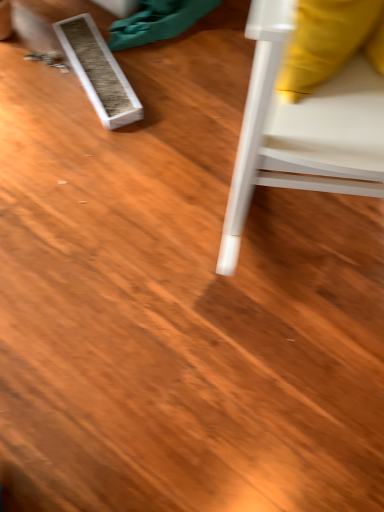
This screenshot has height=512, width=384. What are the coordinates of `white textured box at upper left` in the screenshot? It's located at (98, 72).

Image resolution: width=384 pixels, height=512 pixels. What do you see at coordinates (98, 72) in the screenshot?
I see `white textured box at upper left` at bounding box center [98, 72].

The image size is (384, 512). In order to click on white plastic chair at right in this screenshot , I will do `click(302, 129)`.

What do you see at coordinates (302, 129) in the screenshot? I see `white plastic chair at right` at bounding box center [302, 129].

Image resolution: width=384 pixels, height=512 pixels. Identify the location of white textured box at upper left. (98, 72).

In the image, is white textured box at upper left on the left side or the right side of white plastic chair at right?

white textured box at upper left is to the left of white plastic chair at right.

Is white textured box at upper left behind white plastic chair at right?

Yes.

Is point (104, 61) closer to camera compared to point (219, 261)?

That is False.

From the image's perspective, is white textured box at upper left above or below white plastic chair at right?

white textured box at upper left is situated higher than white plastic chair at right in the image.

From a real-world perspective, which object rests below the other?

white textured box at upper left is physically lower.

Which of these two, white textured box at upper left or white plastic chair at right, is thinner?

With smaller width is white textured box at upper left.

From their relative heights in the image, would you say white textured box at upper left is taller or shorter than white plastic chair at right?

white textured box at upper left is shorter than white plastic chair at right.

Is white textured box at upper left bigger than white plastic chair at right?

Actually, white textured box at upper left might be smaller than white plastic chair at right.

Can white plastic chair at right be found inside white textured box at upper left?

That's incorrect, white plastic chair at right is not inside white textured box at upper left.

Are white textured box at upper left and white plastic chair at right making contact?

There is a gap between white textured box at upper left and white plastic chair at right.

Is white textured box at upper left oriented away from white plastic chair at right?

No.

What's the angular difference between white textured box at upper left and white plastic chair at right's facing directions?

The angle between the facing direction of white textured box at upper left and the facing direction of white plastic chair at right is 58.8 degrees.

You are a GUI agent. You are given a task and a screenshot of the screen. Output one action in this format:
    pyautogui.click(x=<x>, y=<y>)
    Task: Click on the furniture that is below the white textured box at upper left (from the image's perspective)
    The height and width of the screenshot is (512, 384).
    Given the screenshot: What is the action you would take?
    pyautogui.click(x=302, y=129)

Which object is positioned more to the left, white plastic chair at right or white textured box at upper left?

Positioned to the left is white textured box at upper left.

Is the depth of white plastic chair at right less than that of white textured box at upper left?

Yes, white plastic chair at right is closer to the camera.

Is point (274, 177) farther from viewer compared to point (91, 93)?

No, (274, 177) is in front of (91, 93).

From the image's perspective, is white plastic chair at right located above or below white textured box at upper left?

Based on their image positions, white plastic chair at right is located beneath white textured box at upper left.

From a real-world perspective, is white plastic chair at right physically below white textured box at upper left?

Actually, white plastic chair at right is physically above white textured box at upper left in the real world.

Which of these two, white plastic chair at right or white textured box at upper left, is thinner?

white textured box at upper left is thinner.

Is white plastic chair at right shorter than white textured box at upper left?

No.

Looking at the image, does white plastic chair at right seem bigger or smaller compared to white textured box at upper left?

In the image, white plastic chair at right appears to be larger than white textured box at upper left.

Is white plastic chair at right positioned beyond the bounds of white textured box at upper left?

That's correct, white plastic chair at right is outside of white textured box at upper left.

Is white plastic chair at right positioned far away from white textured box at upper left?

Actually, white plastic chair at right and white textured box at upper left are a little close together.

In the scene shown: Is white plastic chair at right turned away from white textured box at upper left?

No, white plastic chair at right's orientation is not away from white textured box at upper left.

How far apart are white plastic chair at right and white textured box at upper left?

white plastic chair at right and white textured box at upper left are 73.60 centimeters apart from each other.

This screenshot has height=512, width=384. Find the location of `plank below the white plastic chair at right (from a real-world perspective)`. plank below the white plastic chair at right (from a real-world perspective) is located at coordinates (98, 72).

This screenshot has width=384, height=512. What are the coordinates of `plank located on the left of white plastic chair at right` in the screenshot? It's located at (98, 72).

Identify the location of furniture on the right of white textured box at upper left. (302, 129).